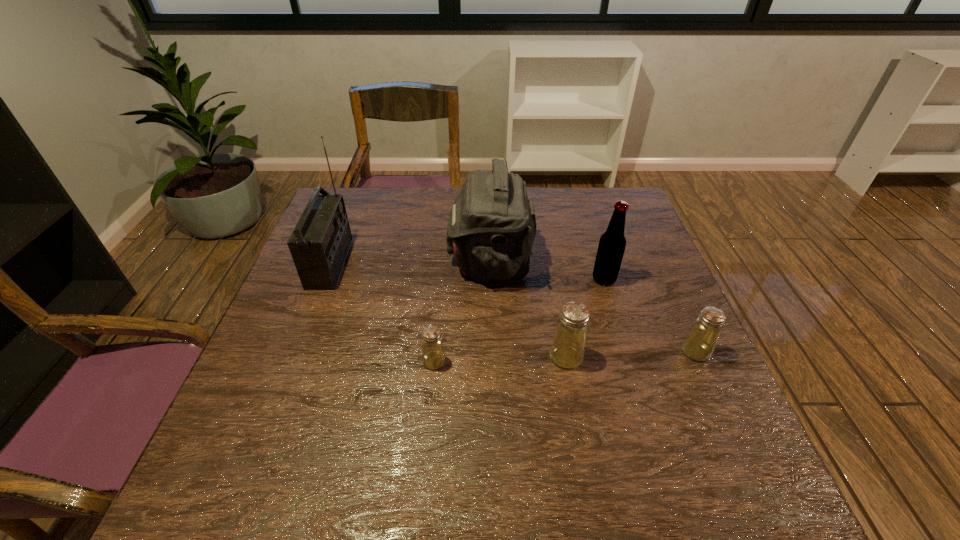
This screenshot has width=960, height=540. In order to click on vacant place for an extra saltshaker on the left in this screenshot , I will do `click(300, 367)`.